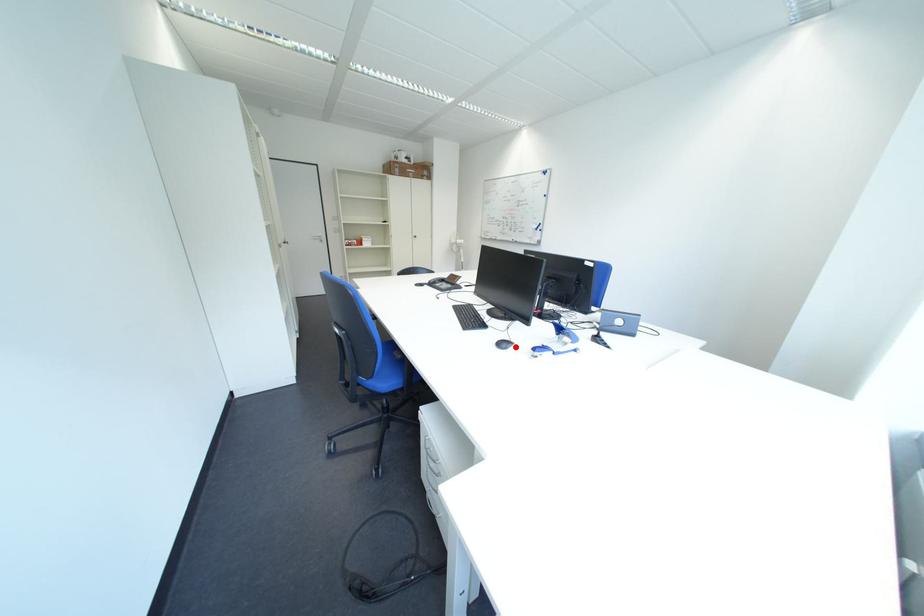
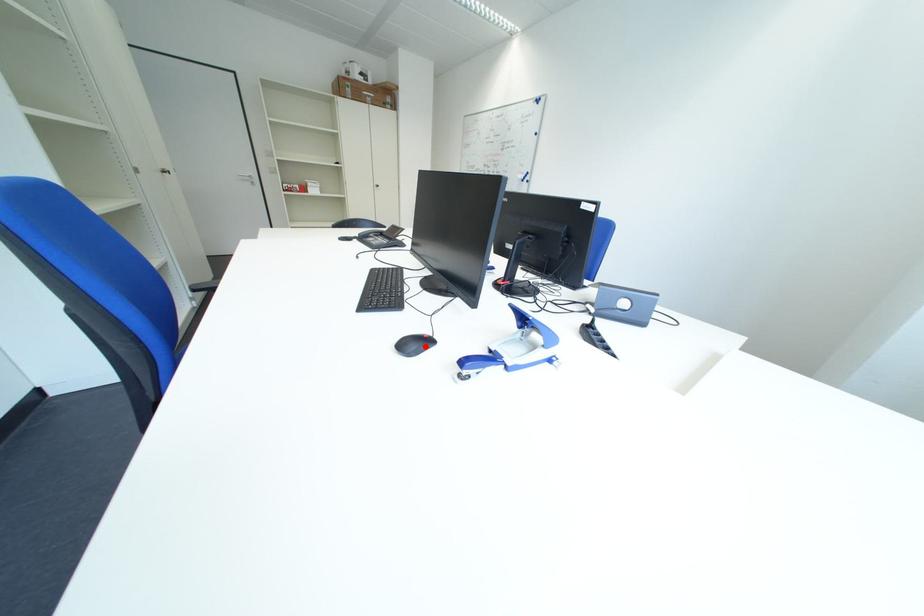
I am providing you with two images of the same scene from different viewpoints. A red point is marked on the first image and another point is marked on the second image. Is the marked point in image1 the same physical position as the marked point in image2?

Yes